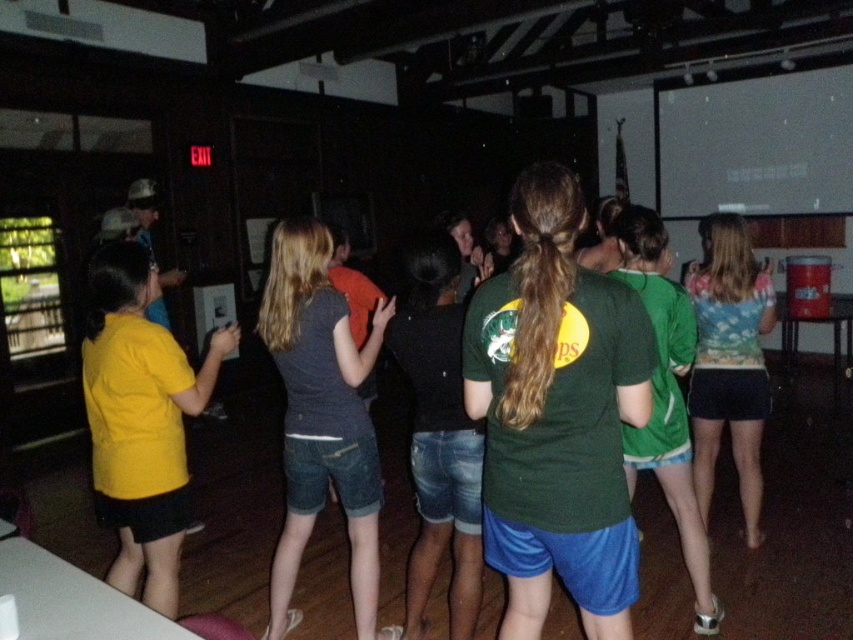
You are organizing a charity event and need to arrange two items on a table. The items are the dark gray denim shorts at center and the yellow matte shirt at left. Based on their sizes, which item should you place first to ensure stability?

The dark gray denim shorts at center is bigger than the yellow matte shirt at left, so you should place the dark gray denim shorts at center first to ensure stability.

You are a photographer trying to capture a candid shot of the group. You notice the dark gray denim shorts at center and the green jersey at center. Which clothing item is closer to the camera?

The dark gray denim shorts at center is positioned under the green jersey at center, so the green jersey at center is closer to the camera.